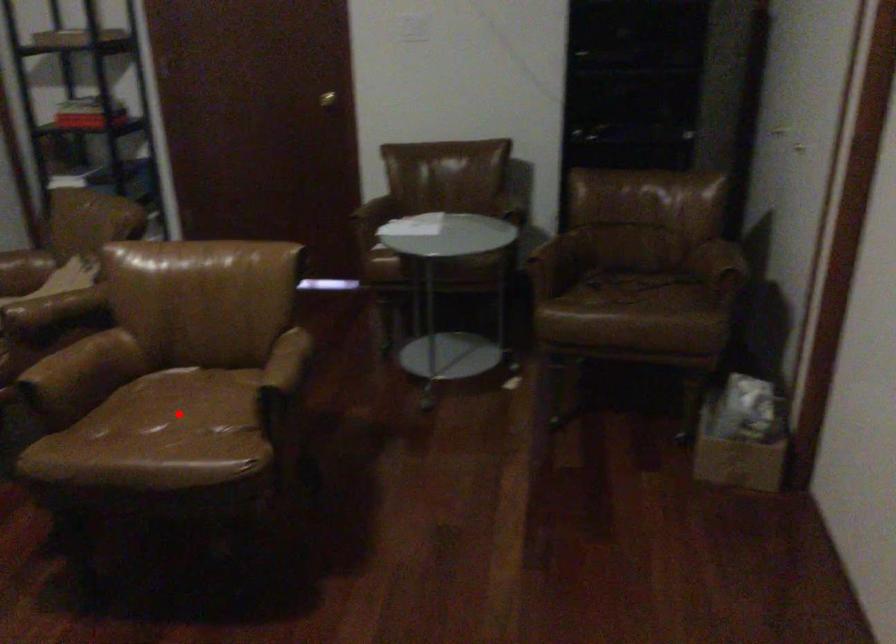
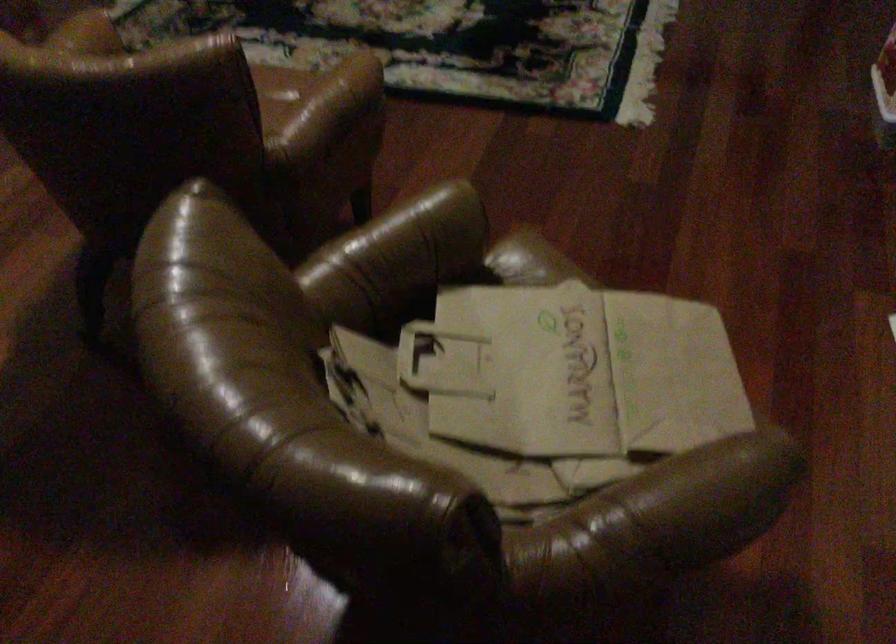
Question: I am providing you with two images of the same scene from different viewpoints. A red point is marked on the first image. At the location where the point appears in image 1, is it still visible in image 2?

Choices:
 (A) Yes
 (B) No

Answer: (B)